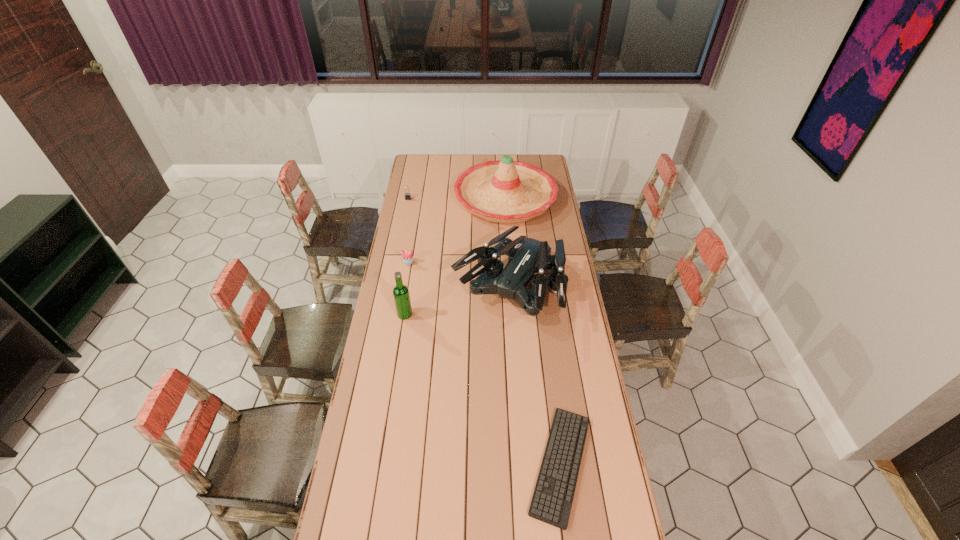
Where is `free space that satisfies the following two spatial constraints: 1. on the back side of the sombrero; 2. on the right side of the beer bottle`? Image resolution: width=960 pixels, height=540 pixels. free space that satisfies the following two spatial constraints: 1. on the back side of the sombrero; 2. on the right side of the beer bottle is located at coordinates point(423,198).

This screenshot has width=960, height=540. In order to click on free location that satisfies the following two spatial constraints: 1. on the shackle of the padlock; 2. on the left side of the beer bottle in this screenshot , I will do `click(386, 314)`.

At what (x,y) coordinates should I click in order to perform the action: click on free point that satisfies the following two spatial constraints: 1. on the face of the cupcake; 2. on the right side of the third tallest object. Please return your answer as a coordinate pair (x, y). The width and height of the screenshot is (960, 540). Looking at the image, I should click on (404, 288).

I want to click on vacant space that satisfies the following two spatial constraints: 1. on the face of the cupcake; 2. on the right side of the beer bottle, so click(399, 314).

Where is `free space that satisfies the following two spatial constraints: 1. on the shackle of the beer bottle; 2. on the right side of the leftmost object`? Image resolution: width=960 pixels, height=540 pixels. free space that satisfies the following two spatial constraints: 1. on the shackle of the beer bottle; 2. on the right side of the leftmost object is located at coordinates (386, 314).

Locate an element on the screen. This screenshot has height=540, width=960. free location that satisfies the following two spatial constraints: 1. on the shackle of the computer keyboard; 2. on the left side of the padlock is located at coordinates (356, 464).